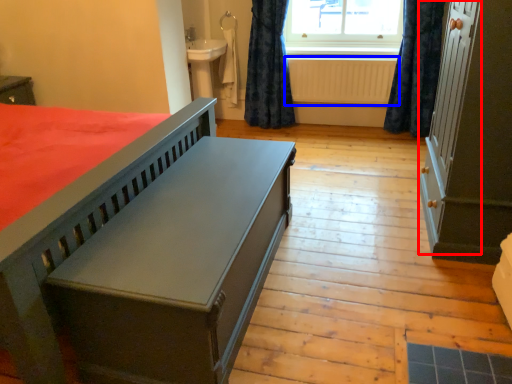
Question: Among these objects, which one is nearest to the camera, screen door (highlighted by a red box) or radiator (highlighted by a blue box)?

Choices:
 (A) screen door
 (B) radiator

Answer: (A)